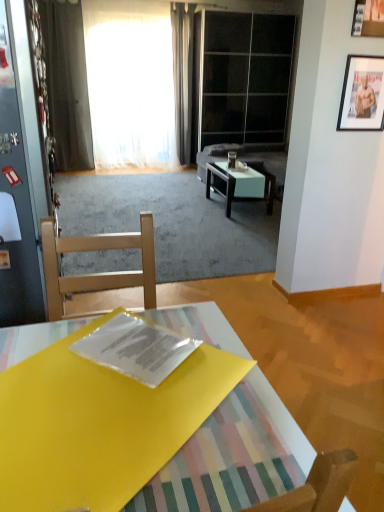
Where is `free spot above yellow plastic folder at center, the second coffee table positioned from the back (from a real-world perspective)`? This screenshot has height=512, width=384. free spot above yellow plastic folder at center, the second coffee table positioned from the back (from a real-world perspective) is located at coordinates (120, 400).